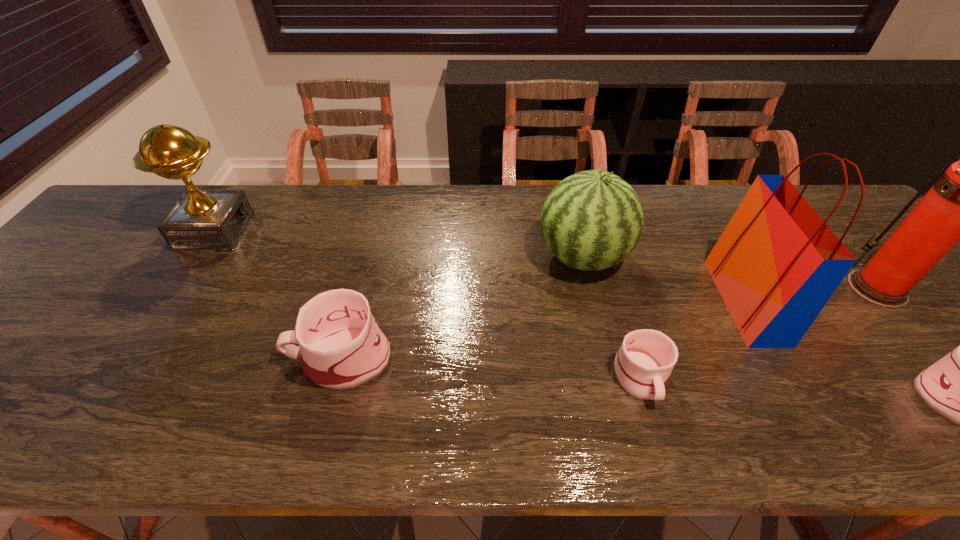
The image size is (960, 540). Identify the location of free space located 0.200m on the side with the handle of the third shortest object. (198, 357).

Locate an element on the screen. This screenshot has height=540, width=960. free spot located 0.180m on the handle side of the shopping bag is located at coordinates (649, 301).

This screenshot has height=540, width=960. Identify the location of free space located 0.260m on the handle side of the shopping bag. (616, 301).

The width and height of the screenshot is (960, 540). What are the coordinates of `vacant space situated on the handle side of the shopping bag` in the screenshot? It's located at (641, 301).

Find the location of a particular element. vacant space located 0.180m on the right of the watermelon is located at coordinates (696, 258).

This screenshot has height=540, width=960. I want to click on vacant space located on the front-facing side of the leftmost object, so click(x=316, y=232).

Locate an element on the screen. Image resolution: width=960 pixels, height=540 pixels. free space located 0.210m at the discharge end of the fire extinguisher is located at coordinates (767, 288).

At what (x,y) coordinates should I click in order to perform the action: click on vacant space located at the discharge end of the fire extinguisher. Please return your answer as a coordinate pair (x, y). Looking at the image, I should click on (791, 288).

The height and width of the screenshot is (540, 960). I want to click on vacant region located 0.170m at the discharge end of the fire extinguisher, so click(783, 288).

Identify the location of watermelon that is at the far edge. Image resolution: width=960 pixels, height=540 pixels. (592, 220).